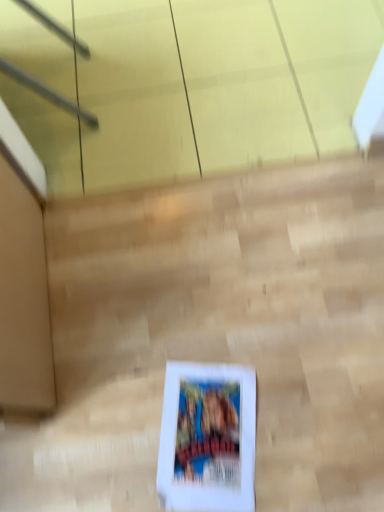
Question: Is white paper at center taller or shorter than white cardboard box at center?

Choices:
 (A) short
 (B) tall

Answer: (A)

Question: From the image's perspective, relative to white cardboard box at center, is white paper at center above or below?

Choices:
 (A) below
 (B) above

Answer: (A)

Question: Looking at their shapes, would you say white paper at center is wider or thinner than white cardboard box at center?

Choices:
 (A) thin
 (B) wide

Answer: (A)

Question: Is point (140, 320) positioned closer to the camera than point (228, 442)?

Choices:
 (A) farther
 (B) closer

Answer: (A)

Question: From the image's perspective, is white cardboard box at center above or below white paper at center?

Choices:
 (A) below
 (B) above

Answer: (B)

Question: Which is correct: white cardboard box at center is inside white paper at center, or outside of it?

Choices:
 (A) outside
 (B) inside

Answer: (A)

Question: Is white cardboard box at center wider or thinner than white paper at center?

Choices:
 (A) wide
 (B) thin

Answer: (A)